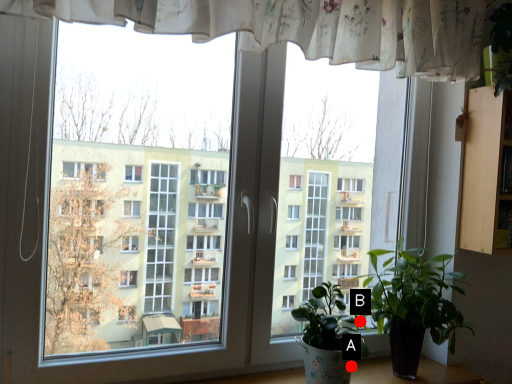
Question: Two points are circled on the image, labeled by A and B beside each circle. Among these points, which one is nearest to the camera?

Choices:
 (A) A is closer
 (B) B is closer

Answer: (A)